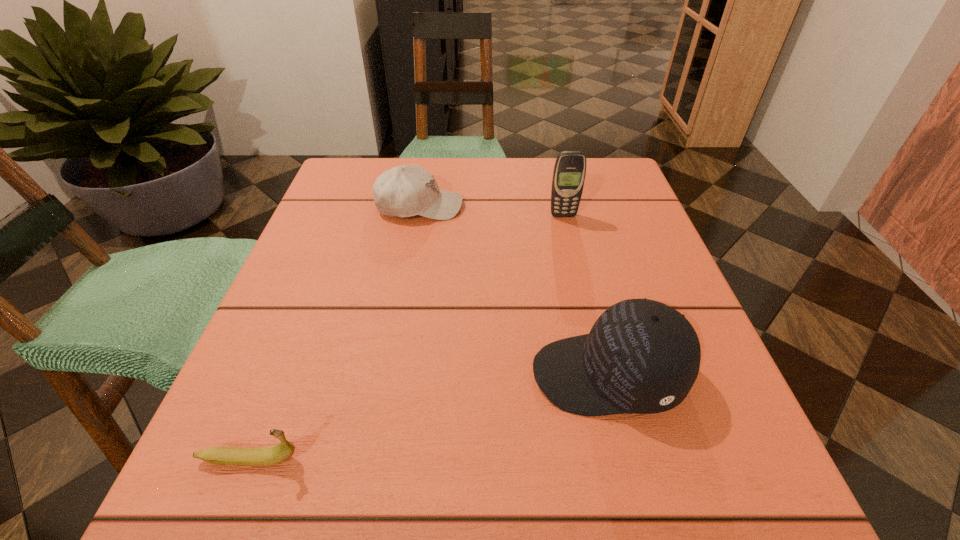
This screenshot has height=540, width=960. What are the coordinates of `free space located at the front of the third farthest object where the brim is located` in the screenshot? It's located at (451, 375).

Where is `vacant position located on the front-facing side of the left baseball cap`? This screenshot has width=960, height=540. vacant position located on the front-facing side of the left baseball cap is located at coordinates (581, 206).

This screenshot has width=960, height=540. Identify the location of free region located 0.260m at the stem of the banana. (506, 460).

Locate an element on the screen. object that is at the far edge is located at coordinates (407, 190).

At what (x,y) coordinates should I click in order to perform the action: click on object that is at the near edge. Please return your answer as a coordinate pair (x, y). Image resolution: width=960 pixels, height=540 pixels. Looking at the image, I should click on (221, 455).

I want to click on baseball cap positioned at the left edge, so click(407, 190).

Identify the location of banana at the left edge. (221, 455).

At what (x,y) coordinates should I click in order to perform the action: click on cellular telephone that is at the right edge. Please return your answer as a coordinate pair (x, y). The width and height of the screenshot is (960, 540). Looking at the image, I should click on (569, 172).

This screenshot has width=960, height=540. I want to click on baseball cap that is at the right edge, so click(641, 356).

Locate an element on the screen. The image size is (960, 540). object positioned at the far left corner is located at coordinates (407, 190).